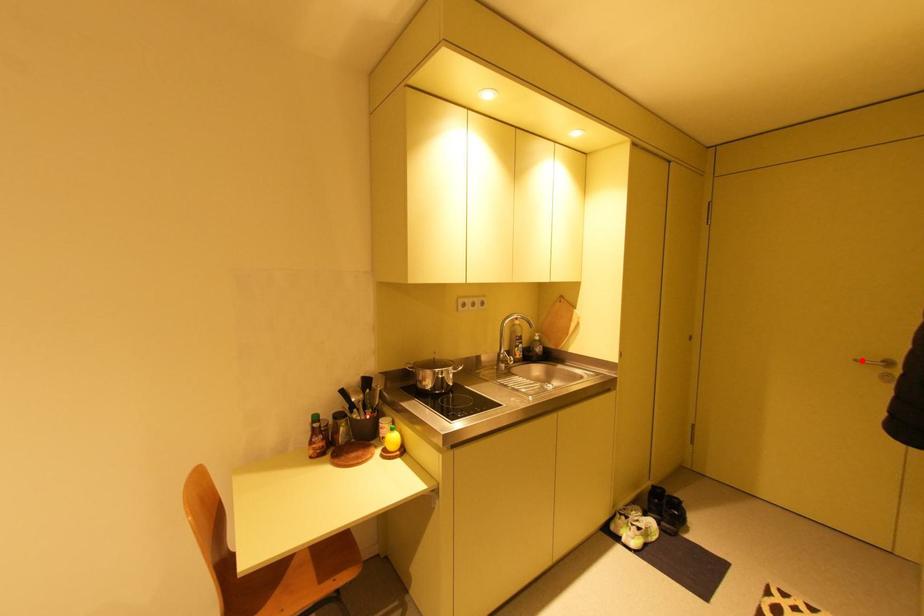
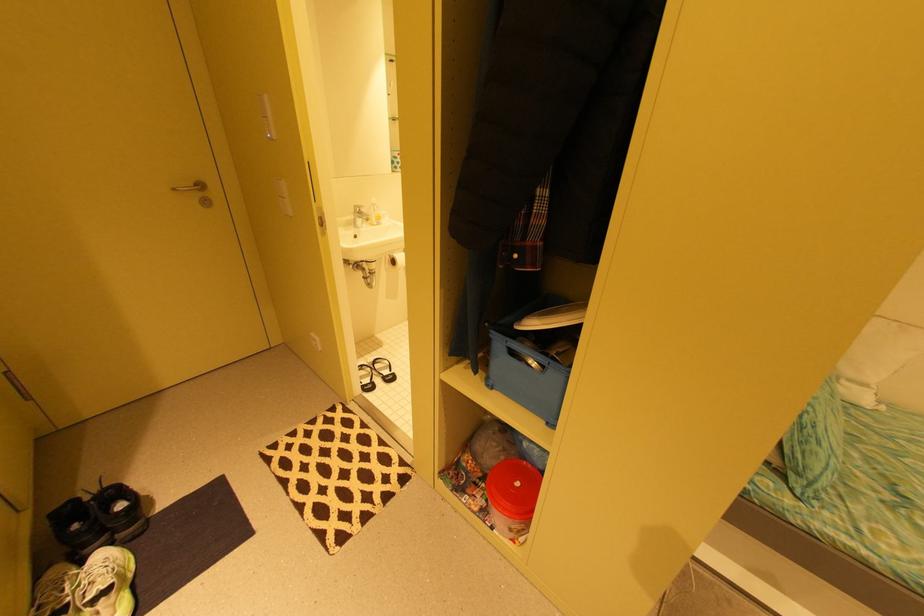
Question: I am providing you with two images of the same scene from different viewpoints. Given a red point in image1, look at the same physical point in image2. Is it:

Choices:
 (A) Closer to the viewpoint
 (B) Farther from the viewpoint

Answer: (A)